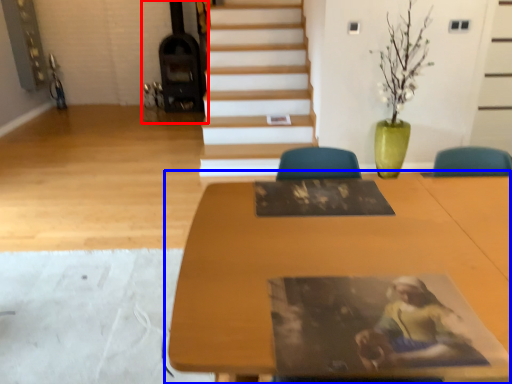
Question: Which object is further to the camera taking this photo, fireplace (highlighted by a red box) or table (highlighted by a blue box)?

Choices:
 (A) fireplace
 (B) table

Answer: (A)